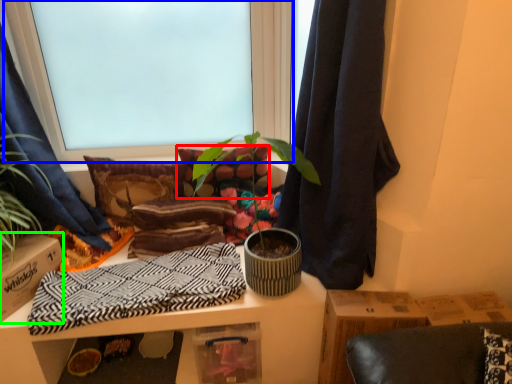
Question: Considering the real-world distances, which object is farthest from pillow (highlighted by a red box)? window (highlighted by a blue box) or cardboard box (highlighted by a green box)?

Choices:
 (A) window
 (B) cardboard box

Answer: (B)